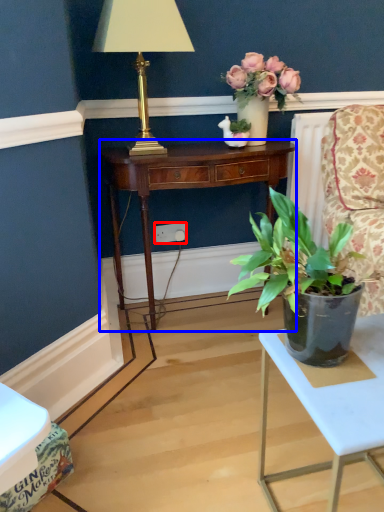
Question: Which of the following is the farthest to the observer, power outlet (highlighted by a red box) or desk (highlighted by a blue box)?

Choices:
 (A) power outlet
 (B) desk

Answer: (A)